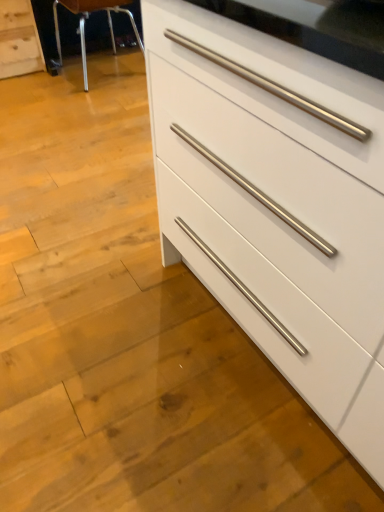
Find the location of a particular element. This screenshot has height=512, width=384. free space in front of white matte chest of drawers at lower left, which ranks as the first chest of drawers in back-to-front order is located at coordinates pyautogui.click(x=19, y=86).